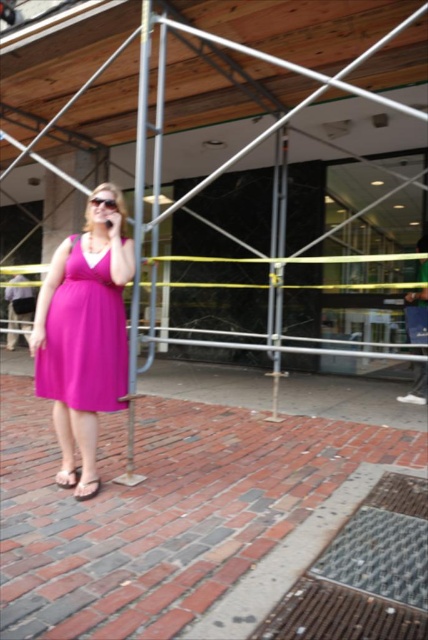
Between point (98, 262) and point (88, 493), which one is positioned in front?

Point (88, 493)

Consider the image. Who is shorter, matte pink dress at center or pink fabric sandal at lower left?

Standing shorter between the two is pink fabric sandal at lower left.

Does point (109, 282) lie in front of point (91, 480)?

No, (109, 282) is behind (91, 480).

I want to click on matte pink dress at center, so click(85, 339).

Is purple satin dress at center below metallic scaffolding at center?

Yes.

Does purple satin dress at center appear on the left side of metallic scaffolding at center?

Yes, purple satin dress at center is to the left of metallic scaffolding at center.

Is point (115, 392) closer to viewer compared to point (275, 300)?

Yes, it is.

Find the location of a particular element. This screenshot has width=428, height=640. purple satin dress at center is located at coordinates (85, 326).

Between matte pink dress at center and metallic scaffolding at center, which one is positioned higher?

metallic scaffolding at center is higher up.

Looking at this image, does matte pink dress at center lie behind metallic scaffolding at center?

No.

Find the location of a particular element. matte pink dress at center is located at coordinates (85, 339).